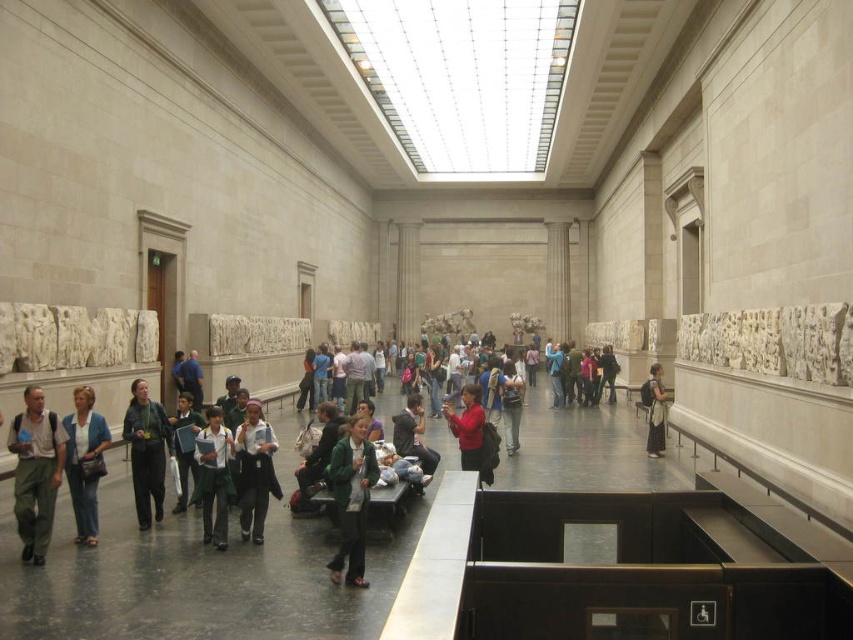
You are standing at the entrance of the gallery and see a green matte jacket at center. What is the position of the point with coordinates (351, 499) in relation to the green matte jacket at center?

The point with coordinates (351, 499) is located on the green matte jacket at center.

From the picture: You are a visitor in the gallery and want to pick up the light brown fabric jacket at lower left. However, there is a matte black backpack at center in the way. Can you reach the jacket without moving the backpack?

The light brown fabric jacket at lower left is positioned under the matte black backpack at center, so you can reach it without moving the backpack since it is underneath.

You are standing in the gallery and want to walk towards the point marked at coordinates (357, 483). Given that the gallery is 100 feet long from front to back, will you reach the point before the end of the gallery?

The point at coordinates (357, 483) is 85.82 feet away from the camera. Since the gallery is 100 feet long, you will reach the point before the end of the gallery.